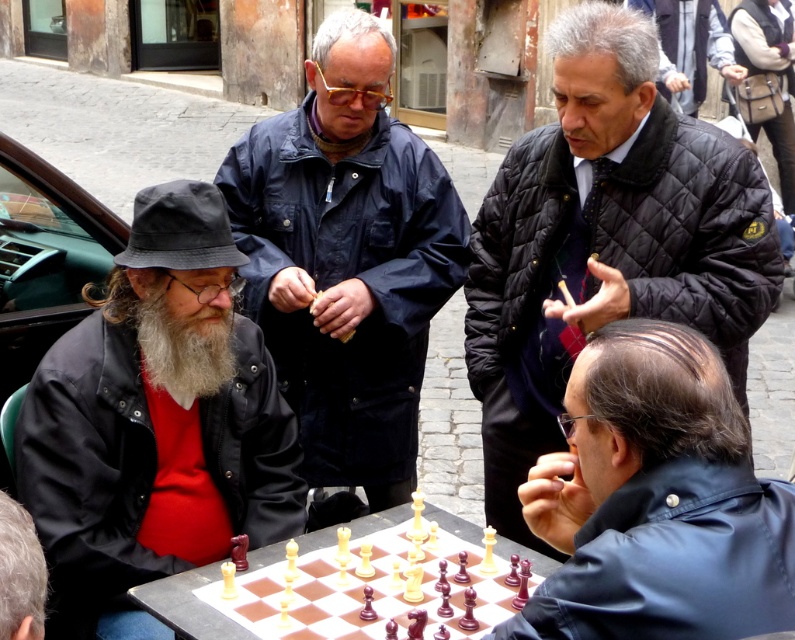
Between quilted black jacket at upper right and gray woolen hat at lower left, which one appears on the right side from the viewer's perspective?

Positioned to the right is quilted black jacket at upper right.

Where is `quilted black jacket at upper right`? quilted black jacket at upper right is located at coordinates (605, 243).

Between point (728, 220) and point (14, 579), which one is positioned in front?

Positioned in front is point (14, 579).

Where is `quilted black jacket at upper right`? This screenshot has width=795, height=640. quilted black jacket at upper right is located at coordinates (605, 243).

Is shiny black jacket at lower right closer to the viewer compared to wooden chess set at center?

Yes, shiny black jacket at lower right is in front of wooden chess set at center.

Does shiny black jacket at lower right have a lesser height compared to wooden chess set at center?

No, shiny black jacket at lower right is not shorter than wooden chess set at center.

Consider the image. Measure the distance between shiny black jacket at lower right and camera.

shiny black jacket at lower right and camera are 7.43 feet apart.

Locate an element on the screen. This screenshot has width=795, height=640. shiny black jacket at lower right is located at coordinates (654, 500).

Can you confirm if matte black jacket at left is thinner than graywoollybeard at left?

In fact, matte black jacket at left might be wider than graywoollybeard at left.

Can you confirm if matte black jacket at left is wider than graywoollybeard at left?

Correct, the width of matte black jacket at left exceeds that of graywoollybeard at left.

You are a GUI agent. You are given a task and a screenshot of the screen. Output one action in this format:
    pyautogui.click(x=<x>, y=<y>)
    Task: Click on the matte black jacket at left
    This screenshot has height=640, width=795.
    Given the screenshot: What is the action you would take?
    pyautogui.click(x=154, y=422)